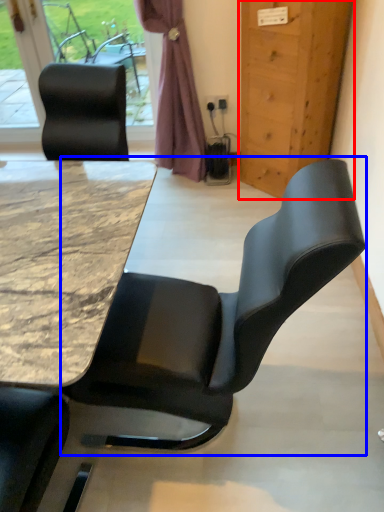
Question: Which object appears closest to the camera in this image, door (highlighted by a red box) or chair (highlighted by a blue box)?

Choices:
 (A) door
 (B) chair

Answer: (B)